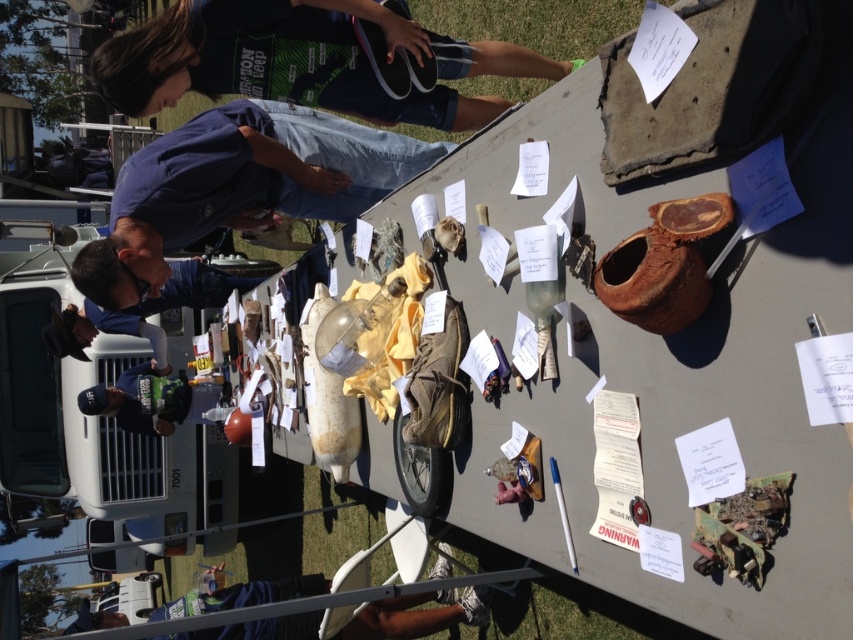
Question: Among these objects, which one is farthest from the camera?

Choices:
 (A) dark blue shirt at upper left
 (B) blue fabric shirt at lower left
 (C) blue denim jeans at upper center

Answer: (B)

Question: Which of these objects is positioned closest to the blue fabric shirt at lower left?

Choices:
 (A) blue denim jeans at upper center
 (B) dark blue shirt at upper left

Answer: (A)

Question: Can you confirm if dark blue shirt at upper left is positioned below blue denim jeans at upper center?

Choices:
 (A) no
 (B) yes

Answer: (A)

Question: Observing the image, what is the correct spatial positioning of dark blue shirt at upper left in reference to blue denim jeans at upper center?

Choices:
 (A) left
 (B) right

Answer: (B)

Question: Which of these objects is positioned closest to the dark blue shirt at upper left?

Choices:
 (A) blue denim jeans at upper center
 (B) blue fabric shirt at lower left

Answer: (A)

Question: Is dark blue shirt at upper left thinner than blue fabric shirt at lower left?

Choices:
 (A) no
 (B) yes

Answer: (A)